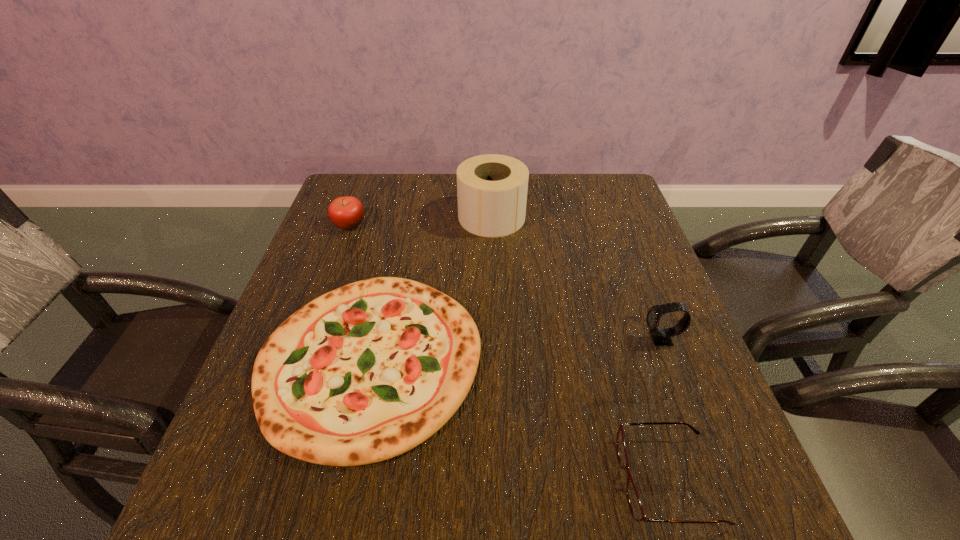
Find the location of a particular element. vacant space located on the right of the pizza is located at coordinates (620, 360).

Where is `blank space located 0.370m on the lenses of the spectacles`? blank space located 0.370m on the lenses of the spectacles is located at coordinates (394, 480).

Identify the location of free space located on the lenses of the spectacles. This screenshot has width=960, height=540. (455, 480).

At what (x,y) coordinates should I click in order to perform the action: click on vacant region located on the lenses of the spectacles. Please return your answer as a coordinate pair (x, y). Image resolution: width=960 pixels, height=540 pixels. Looking at the image, I should click on (480, 480).

The image size is (960, 540). Find the location of `toilet tissue present at the far edge`. toilet tissue present at the far edge is located at coordinates (492, 189).

Where is `apple that is positioned at the far edge`? The image size is (960, 540). apple that is positioned at the far edge is located at coordinates (347, 212).

At what (x,y) coordinates should I click in order to perform the action: click on object that is at the near edge. Please return your answer as a coordinate pair (x, y). The image size is (960, 540). Looking at the image, I should click on (635, 505).

You are a GUI agent. You are given a task and a screenshot of the screen. Output one action in this format:
    pyautogui.click(x=<x>, y=<y>)
    Task: Click on the apple present at the left edge
    The image size is (960, 540).
    Given the screenshot: What is the action you would take?
    pyautogui.click(x=347, y=212)

Find the location of a particular element. This screenshot has width=960, height=540. pizza that is at the left edge is located at coordinates click(366, 372).

The height and width of the screenshot is (540, 960). Find the location of `watch located at the right edge`. watch located at the right edge is located at coordinates (661, 337).